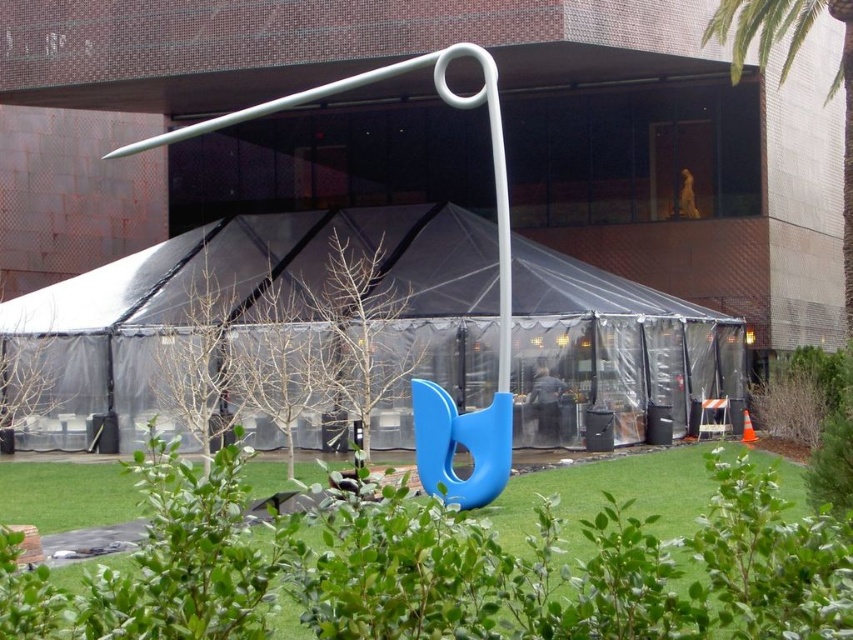
You are a visitor standing at the entrance of the building. You see the transparent plastic tent at center and the green leafy bush at lower right. Which object is taller?

The transparent plastic tent at center is much taller than the green leafy bush at lower right according to the description.